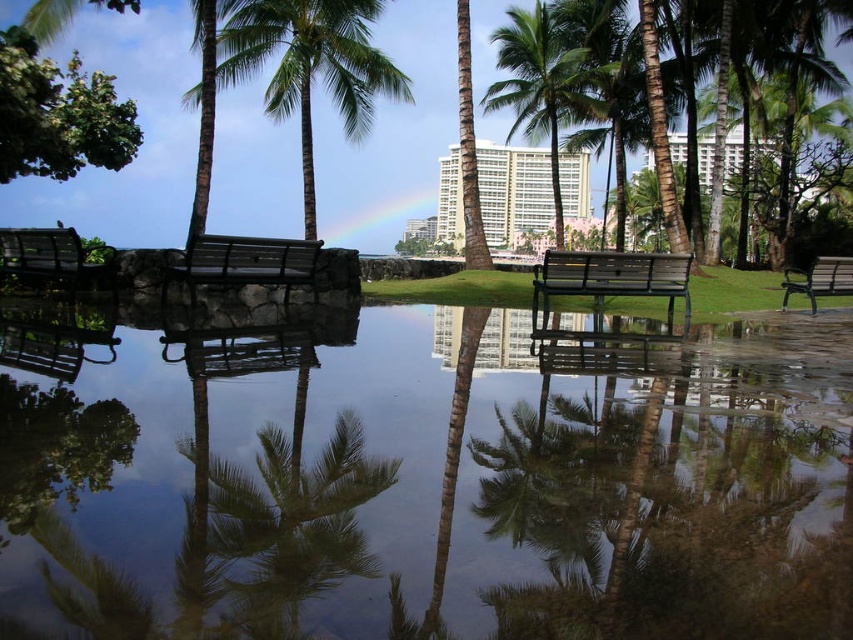
Question: Which point is closer to the camera taking this photo?

Choices:
 (A) (276, 77)
 (B) (84, 266)
 (C) (537, 289)
 (D) (280, 273)

Answer: (B)

Question: Is metallic black bench at center wider than metallic silver bench at left?

Choices:
 (A) no
 (B) yes

Answer: (B)

Question: Is green leafy palm tree at upper center wider than green leafy palm tree at center?

Choices:
 (A) no
 (B) yes

Answer: (A)

Question: Is green leafy palm tree at upper center positioned before metallic black bench at center?

Choices:
 (A) yes
 (B) no

Answer: (B)

Question: Which of these objects is positioned farthest from the metallic silver bench at left?

Choices:
 (A) green leafy palm tree at center
 (B) metallic black bench at center
 (C) green leafy palm tree at upper center

Answer: (A)

Question: Which object appears closest to the camera in this image?

Choices:
 (A) green leafy palm tree at center
 (B) clear glass water at center

Answer: (B)